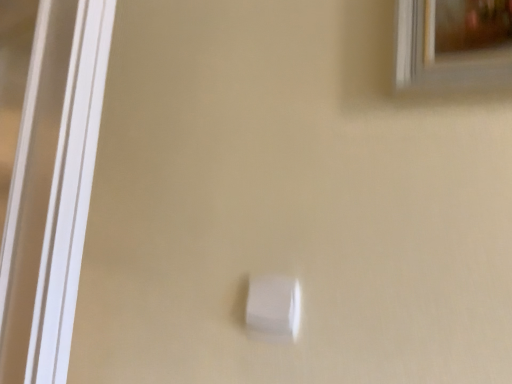
Where is `white plastic light switch at center`? This screenshot has height=384, width=512. white plastic light switch at center is located at coordinates (273, 308).

Measure the distance between white plastic light switch at center and camera.

22.94 inches.

Measure the distance between point (293, 319) and camera.

A distance of 22.95 inches exists between point (293, 319) and camera.

The width and height of the screenshot is (512, 384). What do you see at coordinates (273, 308) in the screenshot?
I see `white plastic light switch at center` at bounding box center [273, 308].

The width and height of the screenshot is (512, 384). Identify the location of matte gold frame at upper right. (453, 42).

The image size is (512, 384). What do you see at coordinates (453, 42) in the screenshot? I see `matte gold frame at upper right` at bounding box center [453, 42].

Locate an element on the screen. The image size is (512, 384). white plastic light switch at center is located at coordinates (273, 308).

Considering the relative positions of matte gold frame at upper right and white plastic light switch at center in the image provided, is matte gold frame at upper right to the left of white plastic light switch at center from the viewer's perspective?

No, matte gold frame at upper right is not to the left of white plastic light switch at center.

Is matte gold frame at upper right in front of white plastic light switch at center?

Yes.

Considering the positions of points (408, 15) and (295, 314), is point (408, 15) closer to camera compared to point (295, 314)?

Yes, it is.

From the image's perspective, which one is positioned higher, matte gold frame at upper right or white plastic light switch at center?

matte gold frame at upper right appears higher in the image.

In the scene shown: From a real-world perspective, between matte gold frame at upper right and white plastic light switch at center, who is vertically lower?

In real-world perspective, white plastic light switch at center is lower.

Does matte gold frame at upper right have a lesser width compared to white plastic light switch at center?

No, matte gold frame at upper right is not thinner than white plastic light switch at center.

Is matte gold frame at upper right shorter than white plastic light switch at center?

No.

Is matte gold frame at upper right smaller than white plastic light switch at center?

No, matte gold frame at upper right is not smaller than white plastic light switch at center.

Is matte gold frame at upper right outside of white plastic light switch at center?

Yes, matte gold frame at upper right is not within white plastic light switch at center.

Looking at this image, are matte gold frame at upper right and white plastic light switch at center making contact?

matte gold frame at upper right is not next to white plastic light switch at center, and they're not touching.

Is matte gold frame at upper right oriented away from white plastic light switch at center?

No, matte gold frame at upper right's orientation is not away from white plastic light switch at center.

At what (x,y) coordinates should I click in order to perform the action: click on light switch below the matte gold frame at upper right (from a real-world perspective). Please return your answer as a coordinate pair (x, y). Looking at the image, I should click on (273, 308).

Between white plastic light switch at center and matte gold frame at upper right, which one appears on the right side from the viewer's perspective?

matte gold frame at upper right.

Between white plastic light switch at center and matte gold frame at upper right, which one is positioned in front?

matte gold frame at upper right is closer to the camera.

Is point (277, 304) positioned after point (476, 68)?

Yes, it is behind point (476, 68).

From the image's perspective, would you say white plastic light switch at center is shown under matte gold frame at upper right?

Indeed, from the image's perspective, white plastic light switch at center is shown beneath matte gold frame at upper right.

From a real-world perspective, which object rests below the other?

In real-world perspective, white plastic light switch at center is lower.

Looking at their sizes, would you say white plastic light switch at center is wider or thinner than matte gold frame at upper right?

white plastic light switch at center is thinner than matte gold frame at upper right.

Is white plastic light switch at center taller or shorter than matte gold frame at upper right?

In the image, white plastic light switch at center appears to be shorter than matte gold frame at upper right.

Does white plastic light switch at center have a larger size compared to matte gold frame at upper right?

Incorrect, white plastic light switch at center is not larger than matte gold frame at upper right.

Is white plastic light switch at center outside of matte gold frame at upper right?

white plastic light switch at center is positioned outside matte gold frame at upper right.

Is white plastic light switch at center with matte gold frame at upper right?

There is a gap between white plastic light switch at center and matte gold frame at upper right.

Is white plastic light switch at center facing towards matte gold frame at upper right?

No, white plastic light switch at center does not turn towards matte gold frame at upper right.

At what (x,y) coordinates should I click in order to perform the action: click on window on the right of white plastic light switch at center. Please return your answer as a coordinate pair (x, y). Looking at the image, I should click on (453, 42).

Locate an element on the screen. This screenshot has height=384, width=512. light switch behind the matte gold frame at upper right is located at coordinates (273, 308).

I want to click on window in front of the white plastic light switch at center, so click(x=453, y=42).